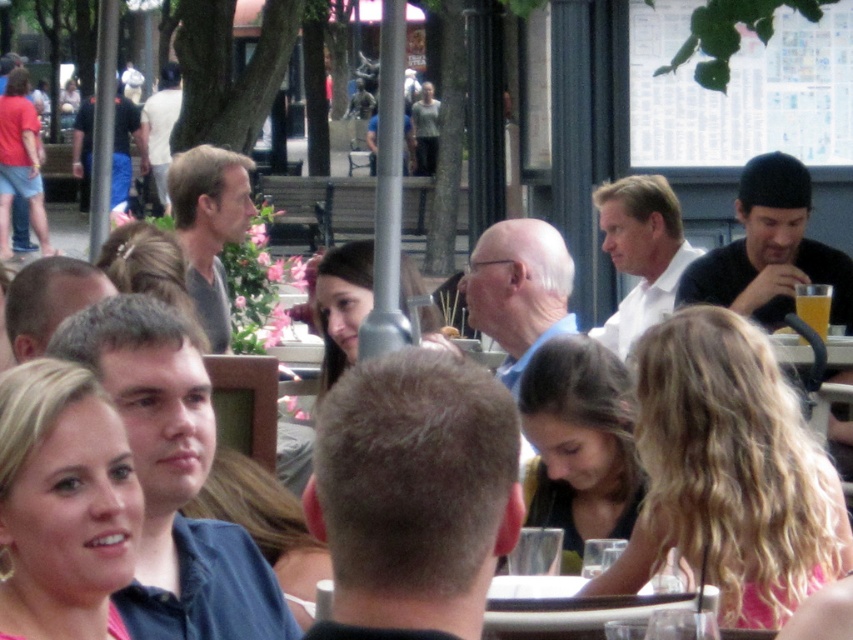
Question: Which of the following is the closest to the observer?

Choices:
 (A) metallic silver table at center
 (B) translucent glass beverage at upper right

Answer: (A)

Question: Does blonde hair at center appear on the right side of dark brown hair at center?

Choices:
 (A) no
 (B) yes

Answer: (A)

Question: Can you confirm if blonde curly hair at center is smaller than dark brown hair at center?

Choices:
 (A) yes
 (B) no

Answer: (B)

Question: Which object is the farthest from the metallic silver table at center?

Choices:
 (A) blonde hair at center
 (B) dark brown hair at center

Answer: (A)

Question: Is metallic silver table at center positioned at the back of translucent glass beverage at upper right?

Choices:
 (A) yes
 (B) no

Answer: (B)

Question: Which point is farther to the camera?

Choices:
 (A) (105, 600)
 (B) (520, 609)
 (C) (796, 330)

Answer: (C)